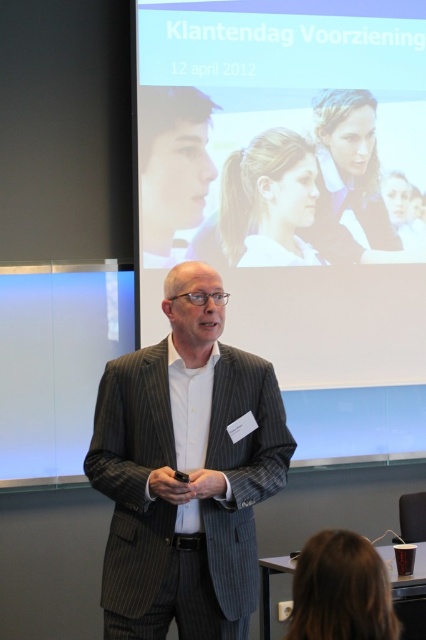
You are an event organizer who needs to adjust the seating arrangement for the upcoming presentation. You notice the striped wool suit at center and the matte black face at upper left in the current setup. Based on their positions, which object is closer to the front of the stage?

The striped wool suit at center is closer to the front of the stage because it is positioned in front of the matte black face at upper left.